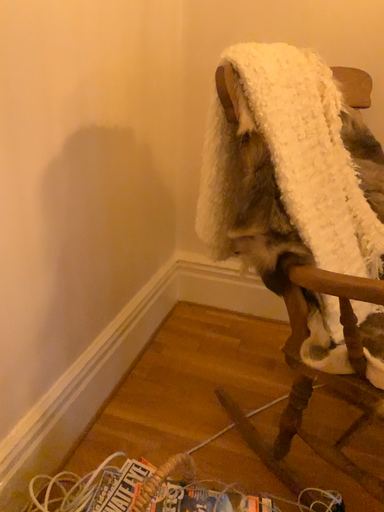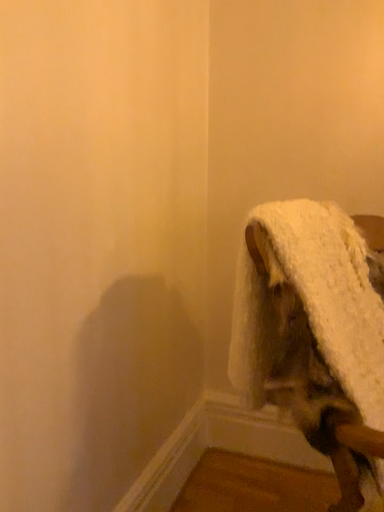
Question: How did the camera likely rotate when shooting the video?

Choices:
 (A) rotated downward
 (B) rotated upward

Answer: (B)